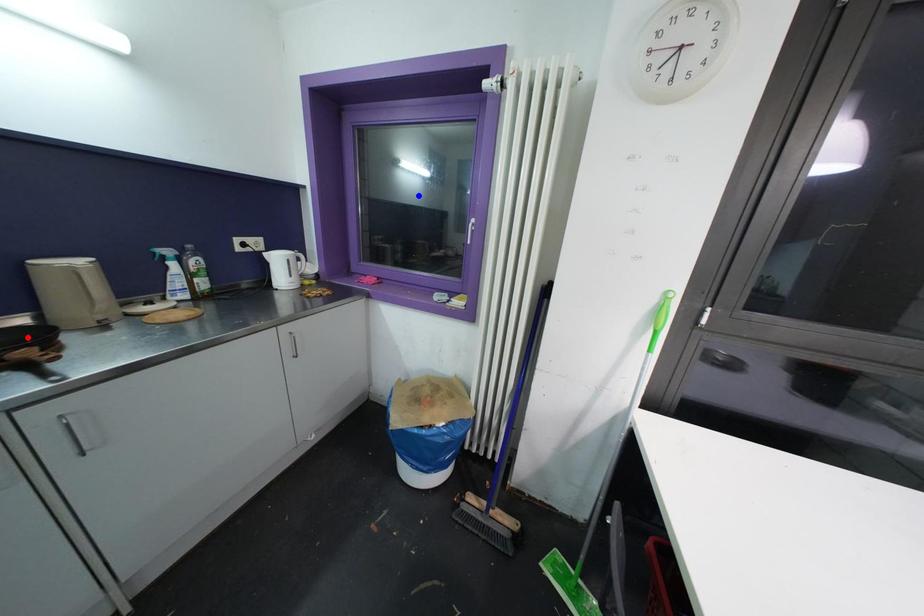
Question: Which of the two points in the image is closer to the camera?

Choices:
 (A) Blue point is closer.
 (B) Red point is closer.

Answer: (B)